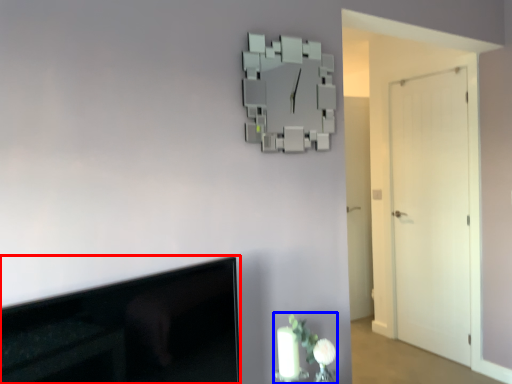
Question: Which object is further to the camera taking this photo, television (highlighted by a red box) or floral arrangement (highlighted by a blue box)?

Choices:
 (A) television
 (B) floral arrangement

Answer: (B)